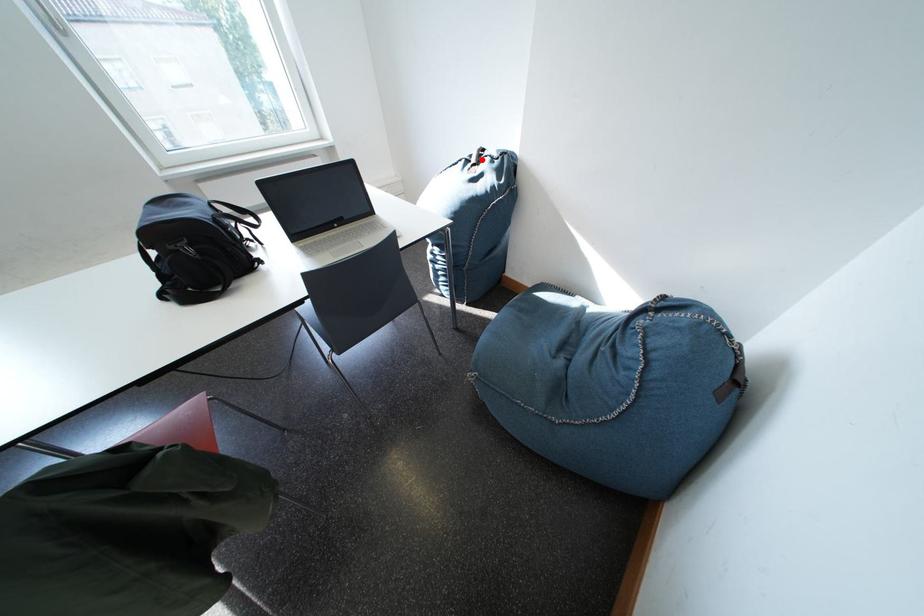
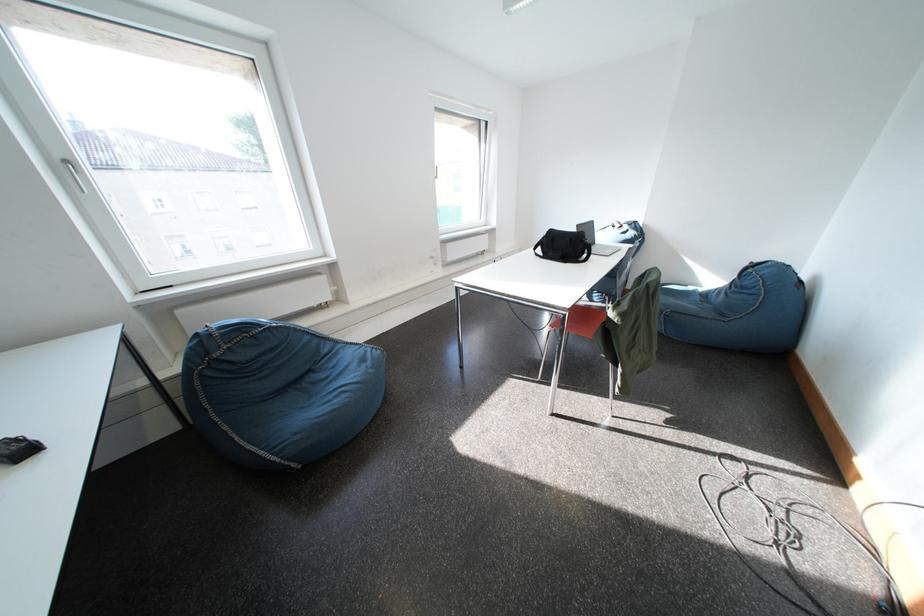
In the second image, find the point that corresponds to the highlighted location in the first image.

(624, 228)